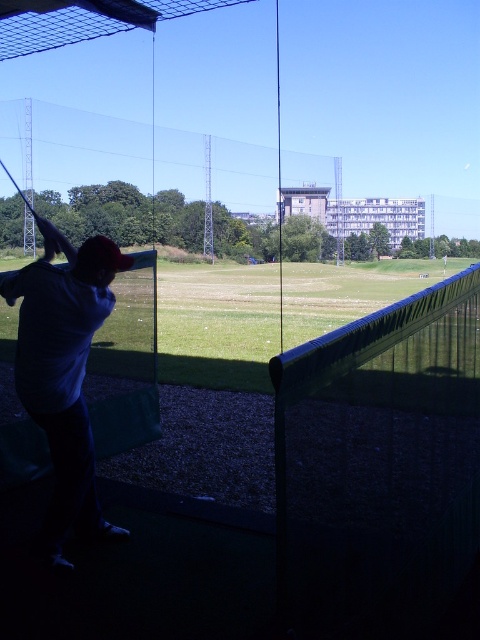
Question: Does green grass at center have a larger size compared to dark blue shirt at left?

Choices:
 (A) yes
 (B) no

Answer: (A)

Question: Which point is closer to the camera?

Choices:
 (A) (85, 314)
 (B) (220, 317)

Answer: (A)

Question: Does green grass at center have a greater width compared to dark blue shirt at left?

Choices:
 (A) yes
 (B) no

Answer: (A)

Question: Can you confirm if green grass at center is positioned to the left of dark blue shirt at left?

Choices:
 (A) yes
 (B) no

Answer: (B)

Question: Among these objects, which one is nearest to the camera?

Choices:
 (A) dark blue shirt at left
 (B) green grass at center

Answer: (A)